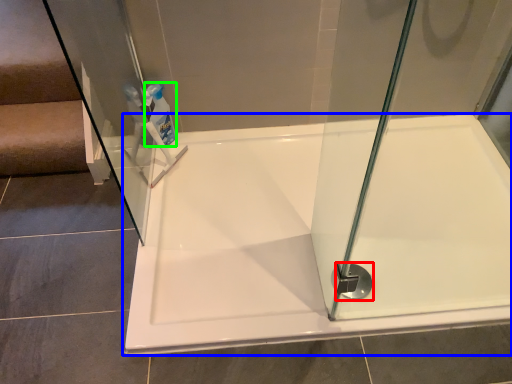
Question: Which object is positioned farthest from shower (highlighted by a red box)? Select from bathtub (highlighted by a blue box) and cleaning product (highlighted by a green box).

Choices:
 (A) bathtub
 (B) cleaning product

Answer: (B)